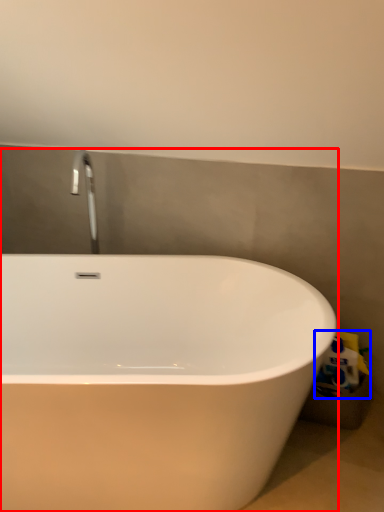
Question: Which object is further to the camera taking this photo, bathtub (highlighted by a red box) or toilet paper (highlighted by a blue box)?

Choices:
 (A) bathtub
 (B) toilet paper

Answer: (B)